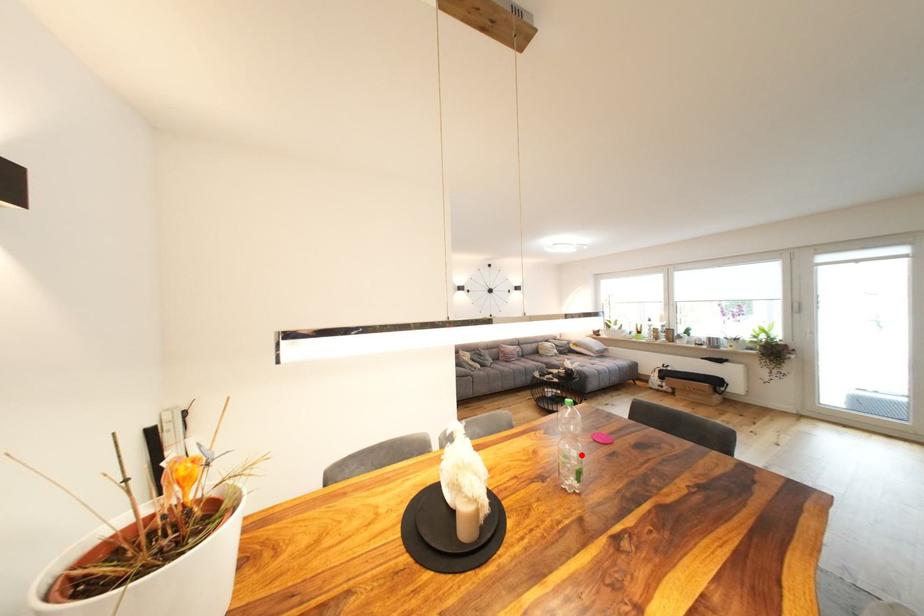
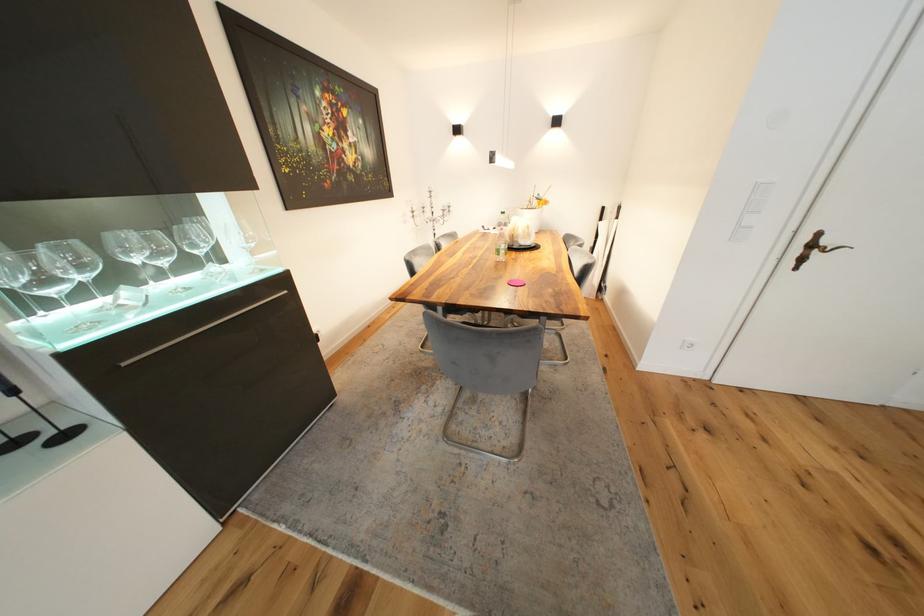
Question: I am providing you with two images of the same scene from different viewpoints. Image1 has a red point marked. In image2, the corresponding 3D location appears at what relative position? Reply with the corresponding letter.

Choices:
 (A) Closer
 (B) Farther

Answer: (A)